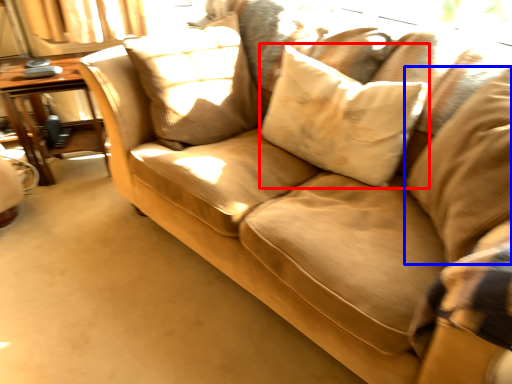
Question: Which point is closer to the camera, pillow (highlighted by a red box) or pillow (highlighted by a blue box)?

Choices:
 (A) pillow
 (B) pillow

Answer: (B)